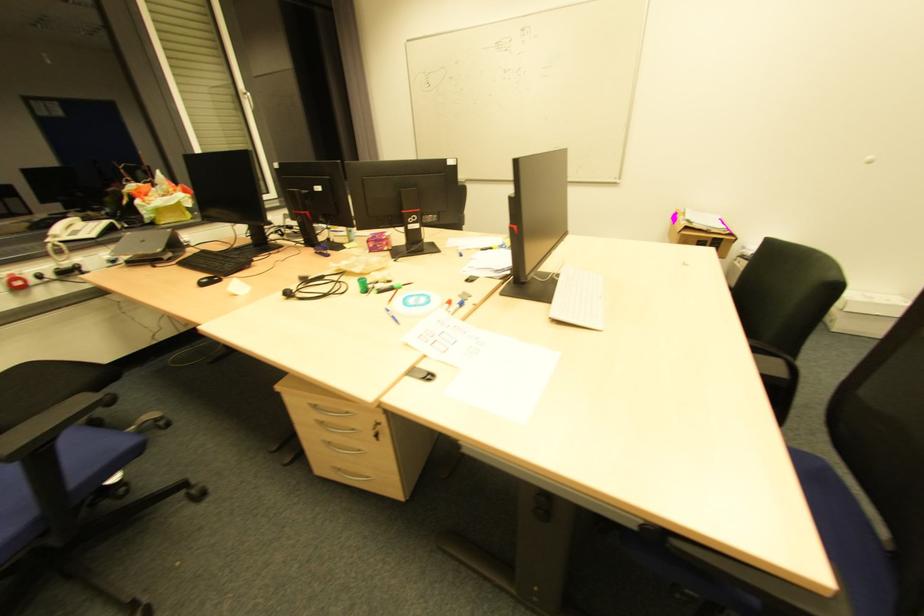
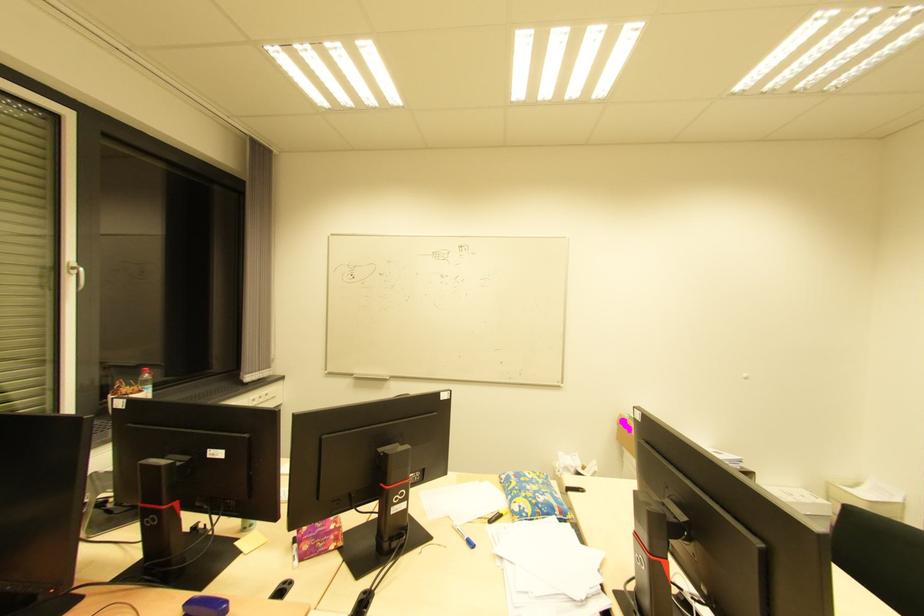
In the second image, find the point that corresponds to the point at 386,249 in the first image.

(332, 548)